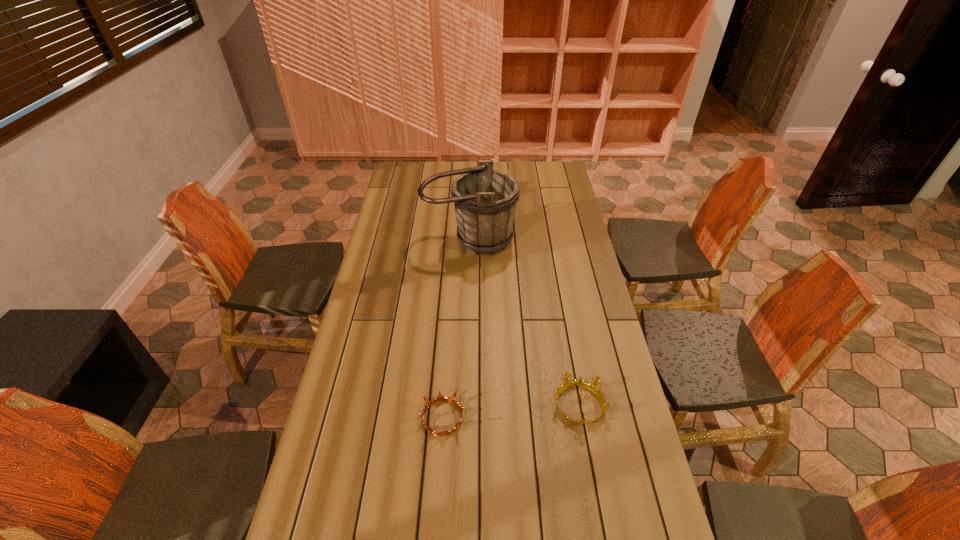
At what (x,y) coordinates should I click in order to perform the action: click on object positioned at the far edge. Please return your answer as a coordinate pair (x, y). Image resolution: width=960 pixels, height=540 pixels. Looking at the image, I should click on (508, 170).

Where is `object located in the right edge section of the desktop`? The height and width of the screenshot is (540, 960). object located in the right edge section of the desktop is located at coordinates (592, 387).

The width and height of the screenshot is (960, 540). I want to click on vacant space at the far edge, so click(x=502, y=168).

At what (x,y) coordinates should I click in order to perform the action: click on vacant space at the left edge of the desktop. Please return your answer as a coordinate pair (x, y). Looking at the image, I should click on (390, 239).

At what (x,y) coordinates should I click in order to perform the action: click on vacant region at the right edge of the desktop. Please return your answer as a coordinate pair (x, y). This screenshot has width=960, height=540. Looking at the image, I should click on (631, 415).

The image size is (960, 540). I want to click on free spot at the far left corner of the desktop, so click(x=409, y=164).

Locate an element on the screen. This screenshot has height=540, width=960. free space at the far right corner of the desktop is located at coordinates (553, 172).

Locate an element on the screen. The width and height of the screenshot is (960, 540). empty location between the rightmost object and the third nearest object is located at coordinates (524, 322).

Image resolution: width=960 pixels, height=540 pixels. I want to click on vacant space that's between the leftmost crown and the tallest object, so click(x=456, y=328).

The height and width of the screenshot is (540, 960). Identify the location of free space between the third nearest object and the rightmost object. (524, 322).